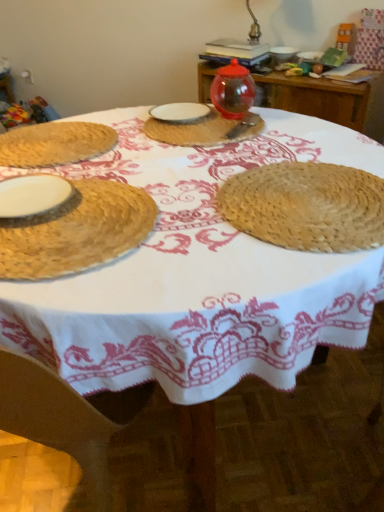
This screenshot has height=512, width=384. I want to click on free area in between white ceramic plate at center, acting as the third tableware starting from the bottom, and woven straw placemat at left, which ranks as the 1th table in left-to-right order, so click(x=126, y=132).